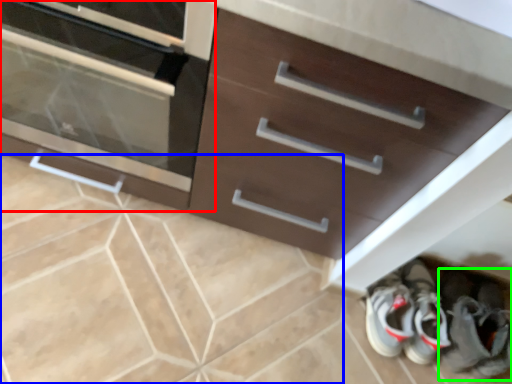
Question: Estimate the real-world distances between objects in this image. Which object is farther from chest of drawers (highlighted by a red box), ceramic tile (highlighted by a blue box) or footwear (highlighted by a green box)?

Choices:
 (A) ceramic tile
 (B) footwear

Answer: (B)